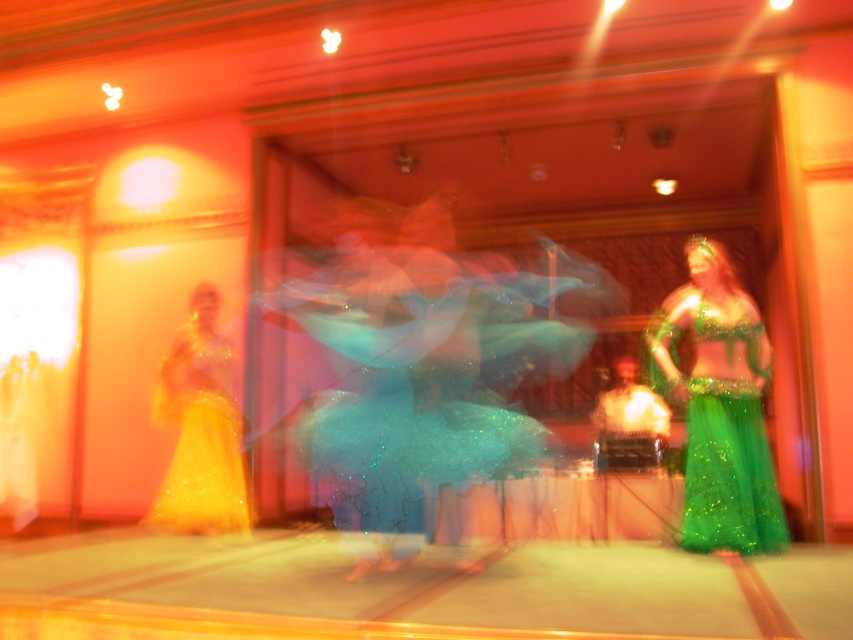
You are standing in the audience watching the dance performance and want to take a photo of the green glittery skirt at center. If your camera has a minimum focus distance of 10 feet, will you be able to capture it clearly?

The green glittery skirt at center is 12.78 feet away from the viewer. Since your camera can focus as close as 10 feet, you can capture it clearly because the distance is within the camera range.

You are a photographer at a dance performance. You need to decide which outfit to focus on for a closeup shot. The green glittery skirt at center and the shiny gold dress at left are both in view. Based on their sizes, which one would be easier to capture in detail without needing to zoom in too much?

The green glittery skirt at center has a larger size compared to the shiny gold dress at left, so it would be easier to capture the green glittery skirt at center in detail without needing to zoom in too much.